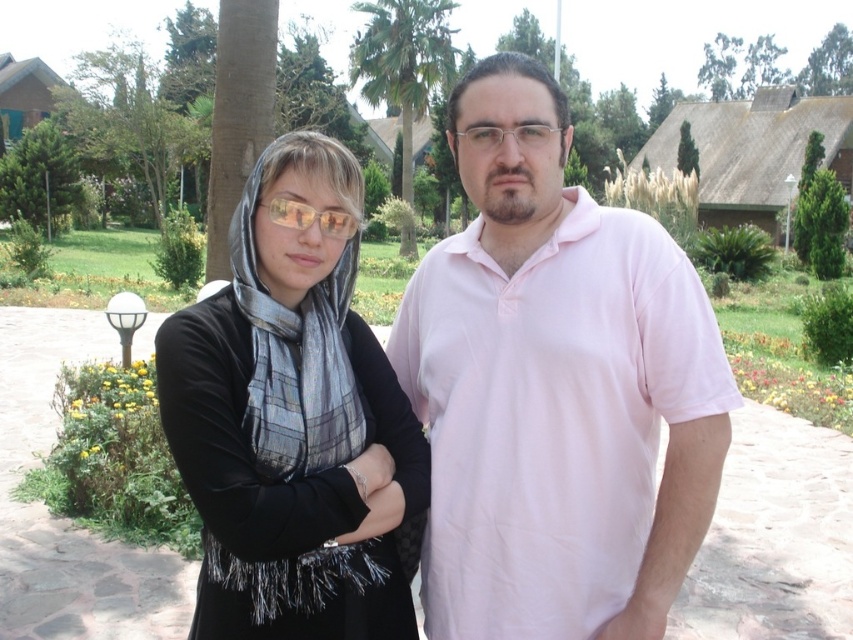
Is point (405, 170) positioned before point (303, 209)?

That is False.

This screenshot has height=640, width=853. What do you see at coordinates (402, 61) in the screenshot?
I see `green leafy palm tree at center` at bounding box center [402, 61].

Which is in front, point (427, 97) or point (335, 230)?

Point (335, 230) is more forward.

Where is `green leafy palm tree at center`? green leafy palm tree at center is located at coordinates (402, 61).

Can you confirm if matte black dress at center is shorter than matte yellow lenses at center?

No, matte black dress at center is not shorter than matte yellow lenses at center.

Which is more to the right, matte black dress at center or matte yellow lenses at center?

matte yellow lenses at center is more to the right.

Measure the distance between matte black dress at center and camera.

1.76 meters

Identify the location of matte black dress at center. (292, 424).

Which of these two, matte black dress at center or green leafy palm tree at center, stands taller?

green leafy palm tree at center is taller.

Who is more distant from viewer, (395, 637) or (438, 8)?

The point (438, 8) is more distant.

Locate an element on the screen. The height and width of the screenshot is (640, 853). matte black dress at center is located at coordinates (292, 424).